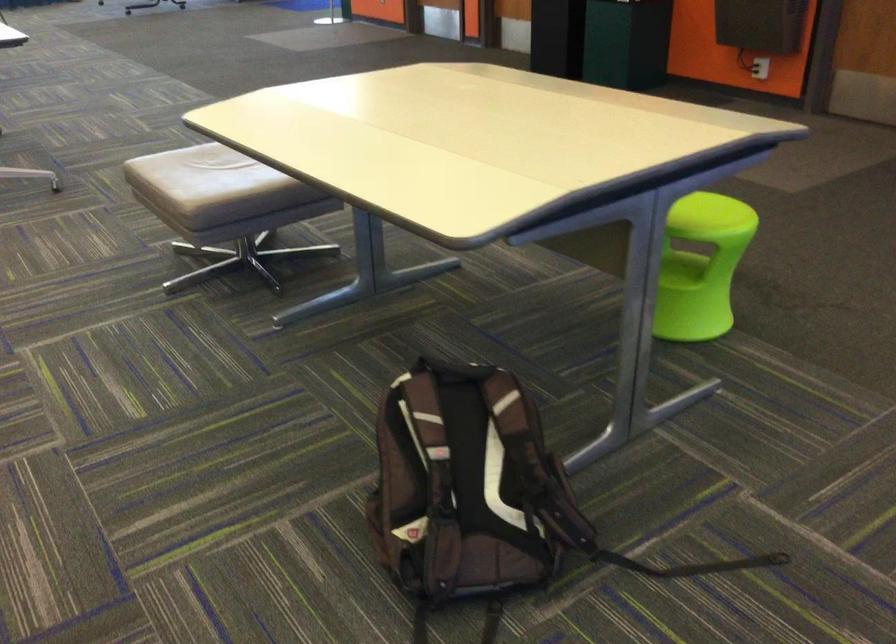
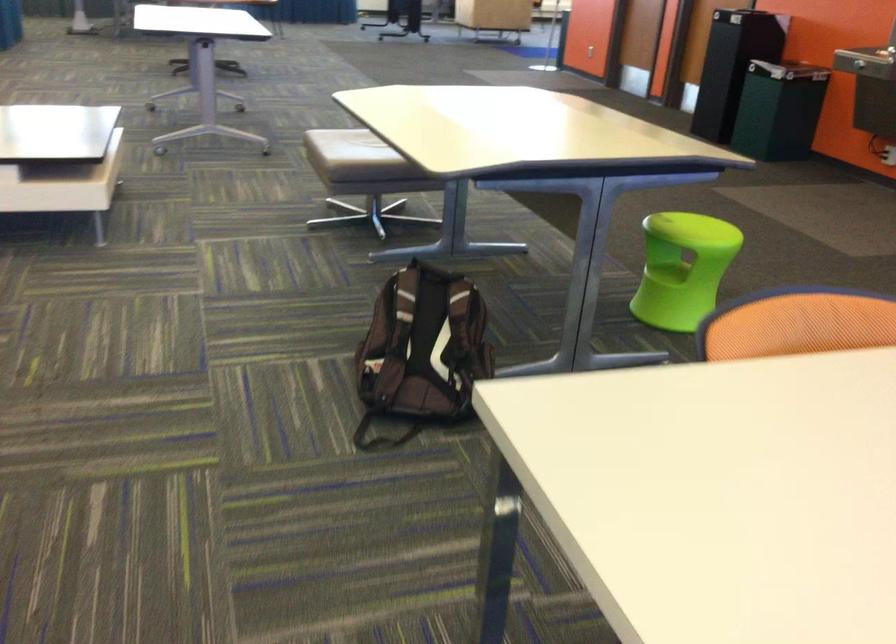
Question: How did the camera likely rotate?

Choices:
 (A) Left
 (B) Right
 (C) Up
 (D) Down

Answer: (A)